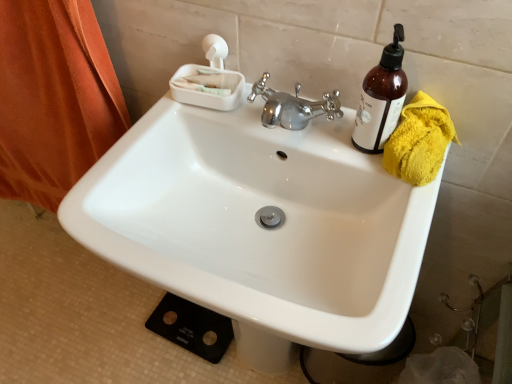
Question: From the image's perspective, would you say yellow fluffy towel at right is shown under white glossy sink at center?

Choices:
 (A) yes
 (B) no

Answer: (B)

Question: Would you consider yellow fluffy towel at right to be distant from white glossy sink at center?

Choices:
 (A) no
 (B) yes

Answer: (A)

Question: Is yellow fluffy towel at right placed right next to white glossy sink at center?

Choices:
 (A) yes
 (B) no

Answer: (B)

Question: From the image's perspective, is yellow fluffy towel at right located above white glossy sink at center?

Choices:
 (A) no
 (B) yes

Answer: (B)

Question: Does yellow fluffy towel at right appear on the right side of white glossy sink at center?

Choices:
 (A) no
 (B) yes

Answer: (B)

Question: Looking at their shapes, would you say orange fabric at left is wider or thinner than white glossy sink at center?

Choices:
 (A) wide
 (B) thin

Answer: (B)

Question: Is point (26, 188) positioned closer to the camera than point (375, 269)?

Choices:
 (A) closer
 (B) farther

Answer: (B)

Question: From a real-world perspective, is orange fabric at left physically located above or below white glossy sink at center?

Choices:
 (A) above
 (B) below

Answer: (A)

Question: From the image's perspective, is orange fabric at left located above or below white glossy sink at center?

Choices:
 (A) above
 (B) below

Answer: (A)

Question: In the image, is orange fabric at left positioned in front of or behind translucent amber bottle at upper right?

Choices:
 (A) behind
 (B) front

Answer: (A)

Question: Considering the positions of orange fabric at left and translucent amber bottle at upper right in the image, is orange fabric at left taller or shorter than translucent amber bottle at upper right?

Choices:
 (A) tall
 (B) short

Answer: (A)

Question: Is orange fabric at left to the left or to the right of translucent amber bottle at upper right in the image?

Choices:
 (A) right
 (B) left

Answer: (B)

Question: Is orange fabric at left inside or outside of translucent amber bottle at upper right?

Choices:
 (A) outside
 (B) inside

Answer: (A)

Question: From the image's perspective, relative to translucent amber bottle at upper right, is white plastic soap dish at upper center above or below?

Choices:
 (A) below
 (B) above

Answer: (B)

Question: Considering the positions of point (203, 102) and point (396, 69), is point (203, 102) closer or farther from the camera than point (396, 69)?

Choices:
 (A) farther
 (B) closer

Answer: (A)